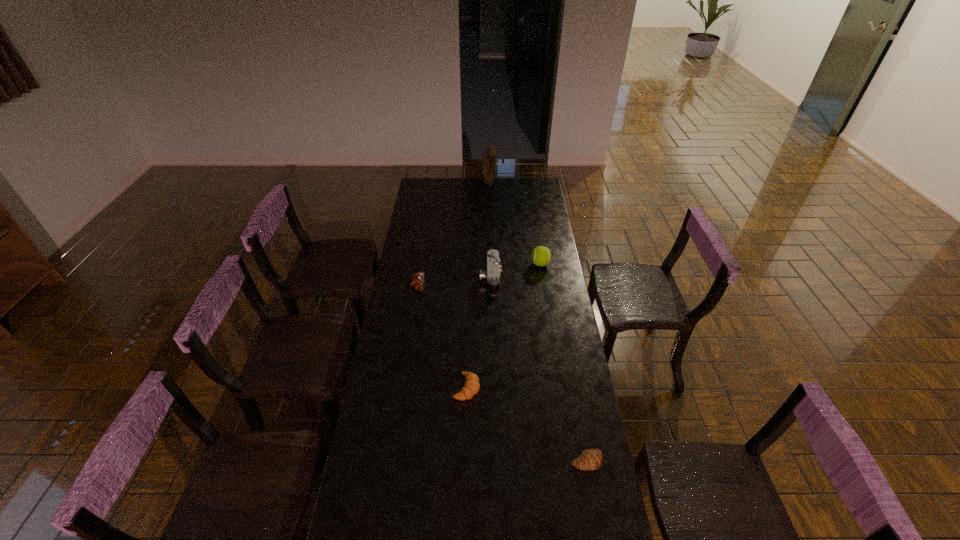
In order to click on free area in between the tallest object and the leftmost crescent roll in this screenshot , I will do `click(453, 234)`.

Locate an element on the screen. This screenshot has height=540, width=960. vacant point located between the leftmost crescent roll and the figurine is located at coordinates (453, 234).

What are the coordinates of `free space between the farthest object and the camera` in the screenshot? It's located at pyautogui.click(x=490, y=232).

What are the coordinates of `free spot between the figurine and the nearest object` in the screenshot? It's located at point(538,323).

Where is `vacant area between the second crescent roll from left to right and the tallest object`? The image size is (960, 540). vacant area between the second crescent roll from left to right and the tallest object is located at coordinates (478, 286).

At what (x,y) coordinates should I click in order to perform the action: click on vacant space in between the leftmost object and the tennis ball. Please return your answer as a coordinate pair (x, y). This screenshot has width=960, height=540. Looking at the image, I should click on (479, 274).

Identify which object is the fifth nearest to the second crescent roll from right to left. Please provide its 2D coordinates. Your answer should be formatted as a tuple, i.e. [(x, y)], where the tuple contains the x and y coordinates of a point satisfying the conditions above.

[(489, 156)]

Locate which object is the closest to the leftmost object. Please provide its 2D coordinates. Your answer should be formatted as a tuple, i.e. [(x, y)], where the tuple contains the x and y coordinates of a point satisfying the conditions above.

[(492, 274)]

The height and width of the screenshot is (540, 960). I want to click on crescent roll that is the second closest to the camera, so [x=471, y=387].

Select which crescent roll appears as the closest to the second nearest object. Please provide its 2D coordinates. Your answer should be formatted as a tuple, i.e. [(x, y)], where the tuple contains the x and y coordinates of a point satisfying the conditions above.

[(590, 459)]